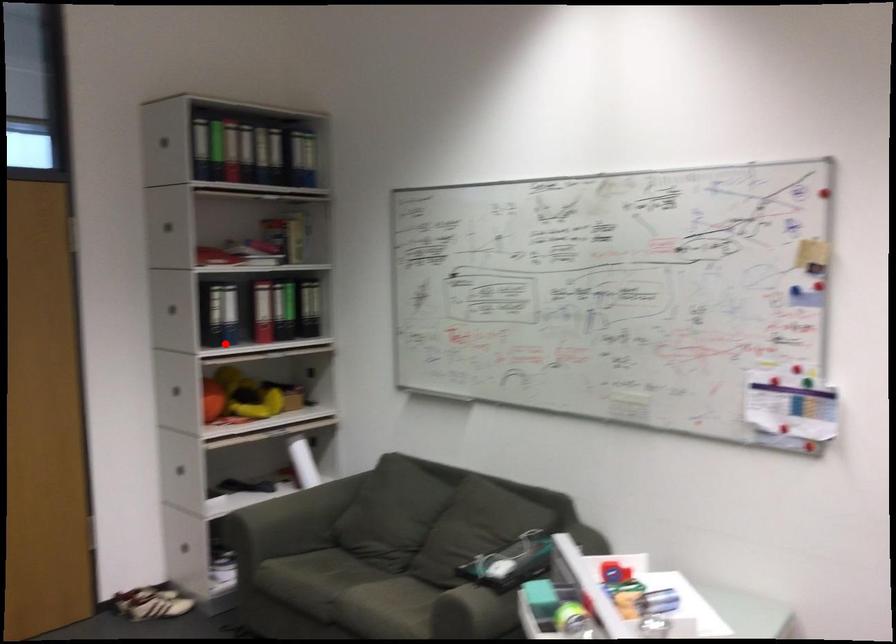
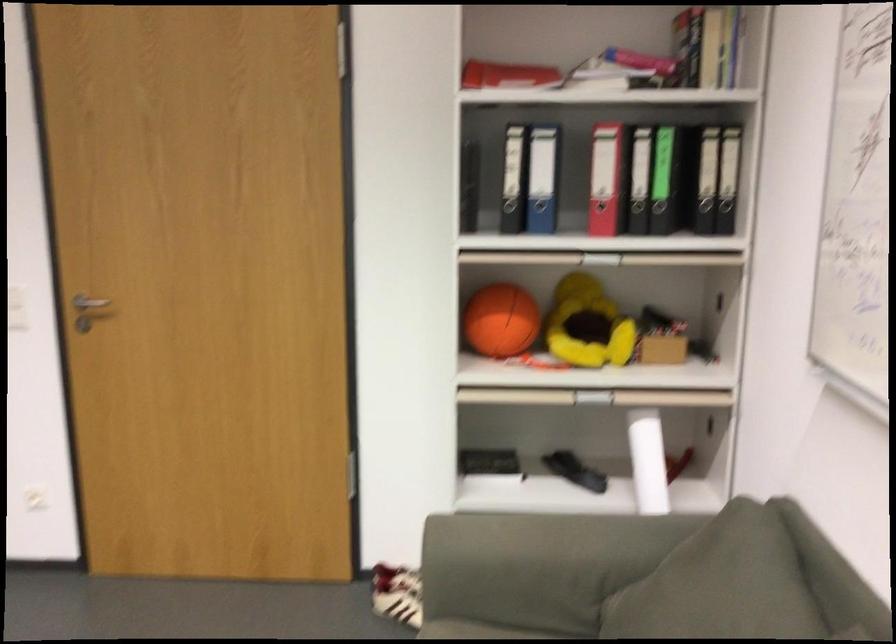
Question: A red point is marked in image1. In image2, is the corresponding 3D point closer to the camera or farther? Reply with the corresponding letter.

Choices:
 (A) The corresponding 3D point is closer.
 (B) The corresponding 3D point is farther.

Answer: (A)